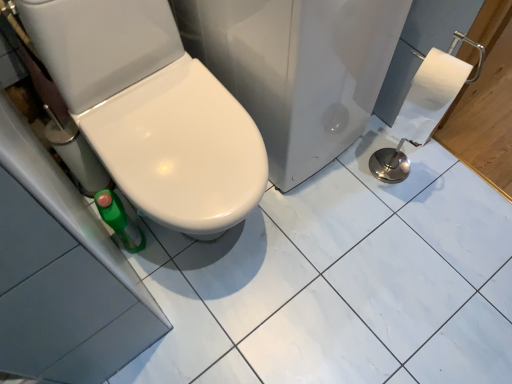
I want to click on white glossy toilet at lower left, so click(x=151, y=111).

Describe the element at coordinates (151, 111) in the screenshot. I see `white glossy toilet at lower left` at that location.

You are a GUI agent. You are given a task and a screenshot of the screen. Output one action in this format:
    pyautogui.click(x=<x>, y=<y>)
    Task: Click on the white glossy toilet seat at center
    
    Given the screenshot: What is the action you would take?
    pyautogui.click(x=297, y=69)

In the scene shown: Measure the distance between white glossy toilet seat at center and camera.

white glossy toilet seat at center is 30.91 inches away from camera.

This screenshot has height=384, width=512. What do you see at coordinates (297, 69) in the screenshot?
I see `white glossy toilet seat at center` at bounding box center [297, 69].

Find the location of a particular element. This screenshot has width=512, height=384. white glossy toilet at lower left is located at coordinates (151, 111).

Does white glossy toilet at lower left appear on the left side of white glossy toilet seat at center?

Correct, you'll find white glossy toilet at lower left to the left of white glossy toilet seat at center.

In the scene shown: Which is in front, white glossy toilet at lower left or white glossy toilet seat at center?

white glossy toilet at lower left is more forward.

Which is behind, point (183, 103) or point (266, 22)?

The point (183, 103) is behind.

From the image's perspective, is white glossy toilet at lower left located above or below white glossy toilet seat at center?

Clearly, from the image's perspective, white glossy toilet at lower left is below white glossy toilet seat at center.

Consider the image. From a real-world perspective, who is located lower, white glossy toilet at lower left or white glossy toilet seat at center?

white glossy toilet at lower left, from a real-world perspective.

Which object is thinner, white glossy toilet at lower left or white glossy toilet seat at center?

white glossy toilet at lower left.

Between white glossy toilet at lower left and white glossy toilet seat at center, which one has less height?

With less height is white glossy toilet at lower left.

Considering the relative sizes of white glossy toilet at lower left and white glossy toilet seat at center in the image provided, is white glossy toilet at lower left smaller than white glossy toilet seat at center?

Indeed, white glossy toilet at lower left has a smaller size compared to white glossy toilet seat at center.

Can we say white glossy toilet at lower left lies outside white glossy toilet seat at center?

That's correct, white glossy toilet at lower left is outside of white glossy toilet seat at center.

Looking at this image, are white glossy toilet at lower left and white glossy toilet seat at center far apart?

white glossy toilet at lower left is actually quite close to white glossy toilet seat at center.

Does white glossy toilet at lower left turn towards white glossy toilet seat at center?

No, white glossy toilet at lower left is not aimed at white glossy toilet seat at center.

In the scene shown: Measure the distance from white glossy toilet at lower left to white glossy toilet seat at center.

white glossy toilet at lower left and white glossy toilet seat at center are 9.53 inches apart from each other.

The height and width of the screenshot is (384, 512). I want to click on porcelain lying behind the white glossy toilet at lower left, so click(x=297, y=69).

In the scene shown: Between white glossy toilet seat at center and white glossy toilet at lower left, which one appears on the right side from the viewer's perspective?

white glossy toilet seat at center.

Which object is further away from the camera, white glossy toilet seat at center or white glossy toilet at lower left?

white glossy toilet seat at center.

Does point (401, 26) lie in front of point (164, 7)?

No.

From the image's perspective, is white glossy toilet seat at center on top of white glossy toilet at lower left?

Yes, from the image's perspective, white glossy toilet seat at center is over white glossy toilet at lower left.

From a real-world perspective, does white glossy toilet seat at center sit lower than white glossy toilet at lower left?

Result: No, from a real-world perspective, white glossy toilet seat at center is not under white glossy toilet at lower left.

Which of these two, white glossy toilet seat at center or white glossy toilet at lower left, is thinner?

With smaller width is white glossy toilet at lower left.

Who is shorter, white glossy toilet seat at center or white glossy toilet at lower left?

Standing shorter between the two is white glossy toilet at lower left.

Considering the sizes of white glossy toilet seat at center and white glossy toilet at lower left in the image, is white glossy toilet seat at center bigger or smaller than white glossy toilet at lower left?

Clearly, white glossy toilet seat at center is larger in size than white glossy toilet at lower left.

Is white glossy toilet seat at center located outside white glossy toilet at lower left?

white glossy toilet seat at center is positioned outside white glossy toilet at lower left.

Are white glossy toilet seat at center and white glossy toilet at lower left making contact?

Answer: No, white glossy toilet seat at center is not next to white glossy toilet at lower left.

Is white glossy toilet seat at center positioned with its back to white glossy toilet at lower left?

No, white glossy toilet seat at center is not facing away from white glossy toilet at lower left.

Can you tell me how much white glossy toilet seat at center and white glossy toilet at lower left differ in facing direction?

1.95 degrees separate the facing orientations of white glossy toilet seat at center and white glossy toilet at lower left.

How distant is white glossy toilet seat at center from white glossy toilet at lower left?

The distance of white glossy toilet seat at center from white glossy toilet at lower left is 9.53 inches.

Find the location of `porcelain behind the white glossy toilet at lower left`. porcelain behind the white glossy toilet at lower left is located at coordinates (297, 69).

Locate an element on the screen. This screenshot has height=384, width=512. porcelain behind the white glossy toilet at lower left is located at coordinates click(x=297, y=69).

Where is `toilet that is under the white glossy toilet seat at center (from a real-world perspective)`? toilet that is under the white glossy toilet seat at center (from a real-world perspective) is located at coordinates (151, 111).